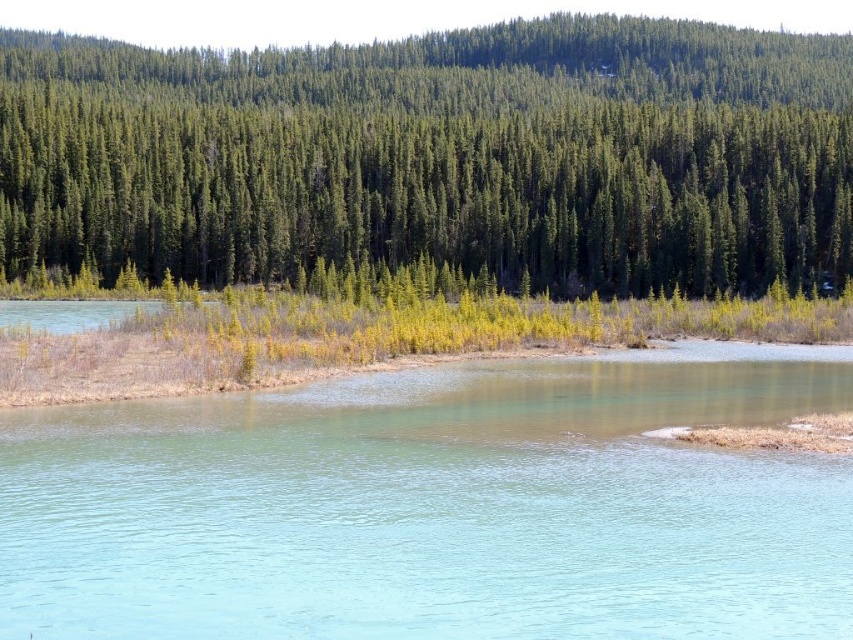
Question: Which object is farther from the camera taking this photo?

Choices:
 (A) clear water at center
 (B) green matte forest at upper center

Answer: (B)

Question: Does clear water at center come in front of green matte forest at upper center?

Choices:
 (A) yes
 (B) no

Answer: (A)

Question: Is clear water at center thinner than green matte forest at upper center?

Choices:
 (A) yes
 (B) no

Answer: (A)

Question: Which point is farther to the camera?

Choices:
 (A) [x=61, y=211]
 (B) [x=466, y=435]

Answer: (A)

Question: Does clear water at center have a lesser width compared to green matte forest at upper center?

Choices:
 (A) no
 (B) yes

Answer: (B)